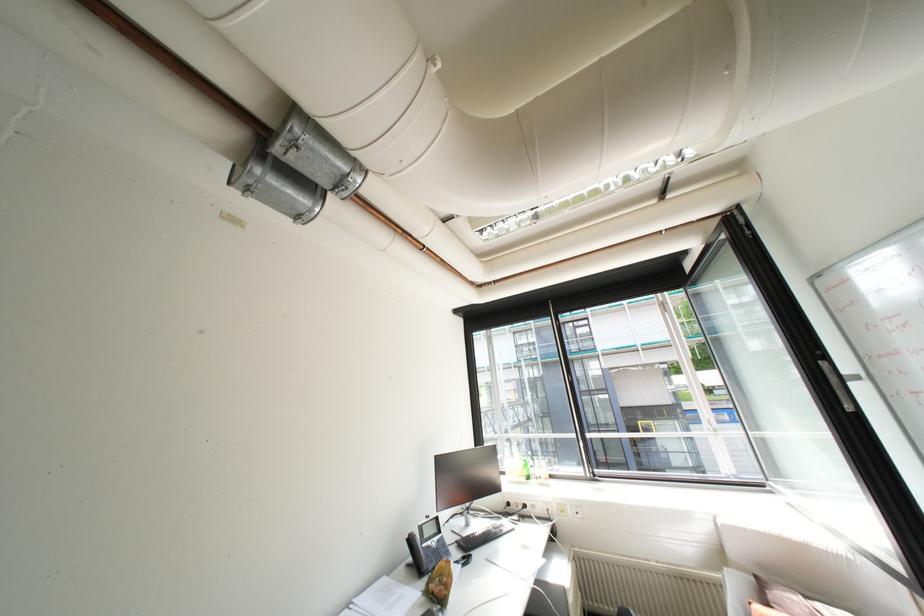
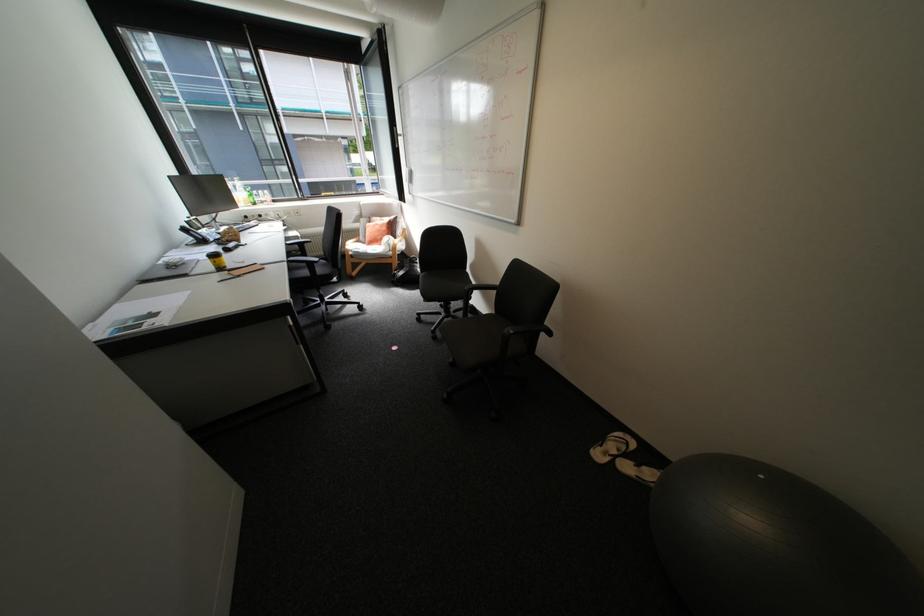
Find the pixel in the second image that matches the point at 528,477 in the first image.

(256, 204)